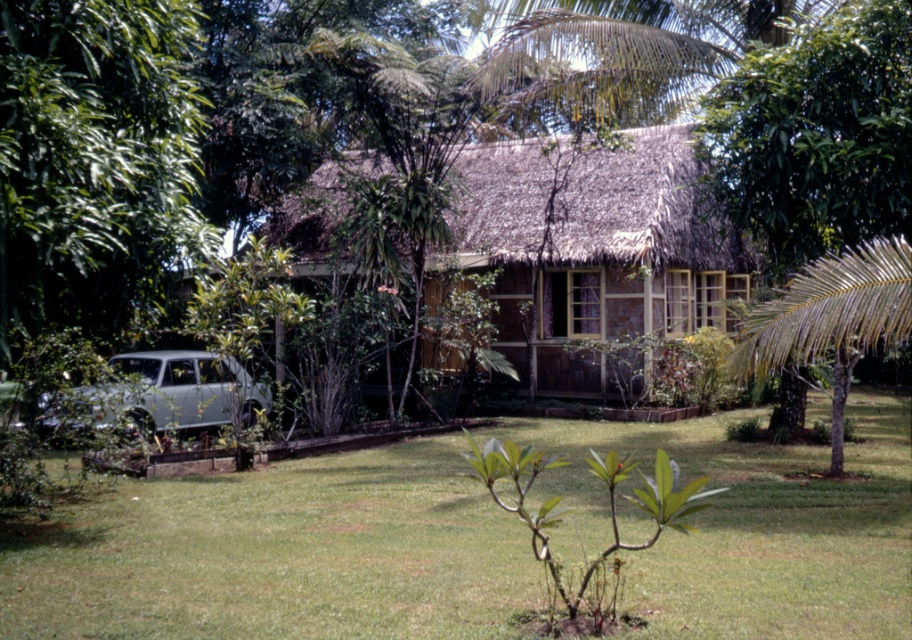
You are planning to park your white matte car at lower left near the green leafy tree at left. Considering their sizes, will the car fit without touching the tree?

The green leafy tree at left might be wider than the white matte car at lower left, so there is a possibility that the car might touch the tree if parked too close. Ensure sufficient space between them to avoid contact.

Based on the photo, you are standing at the entrance of the wooden cottage at center. Looking towards the direction of the lawn, which direction should you face to see the small young tree in the foreground?

The wooden cottage at center is located at point [586,252]. Since the small young tree is in the foreground, you should face towards the front of the cottage to see it.